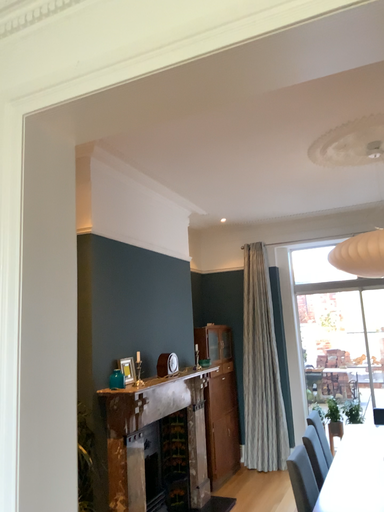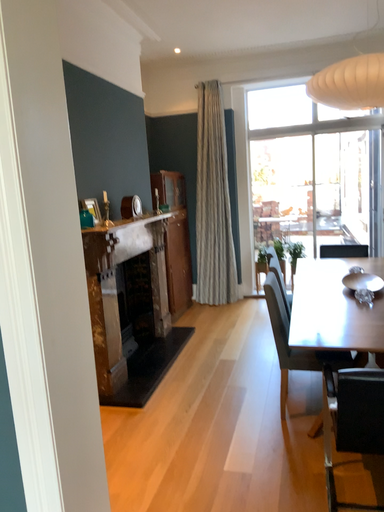
Question: Which way did the camera rotate in the video?

Choices:
 (A) rotated left
 (B) rotated right

Answer: (B)